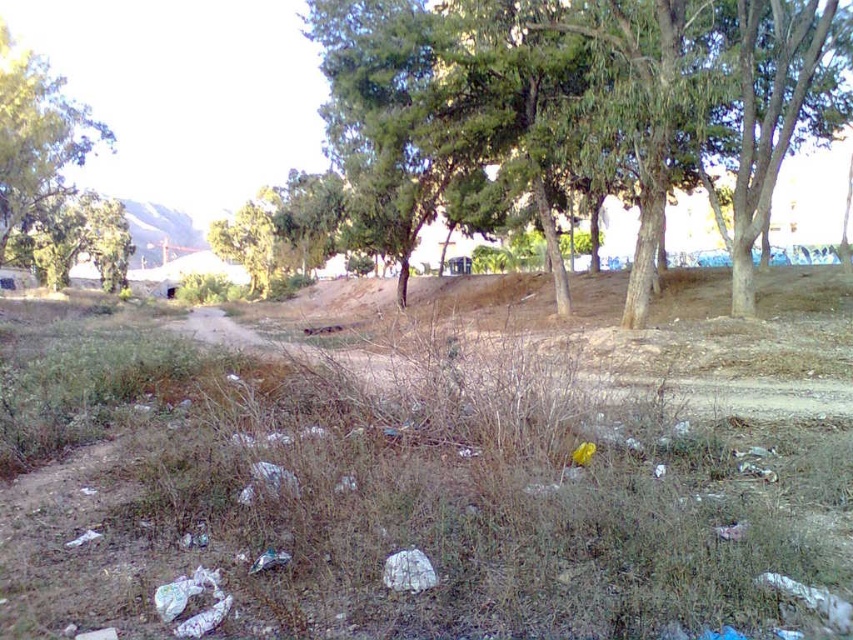
Based on the photo, which of these two, brown grassy dirt field at center or green leafy tree at center, stands taller?

green leafy tree at center

Does brown grassy dirt field at center have a larger size compared to green leafy tree at center?

No.

At what (x,y) coordinates should I click in order to perform the action: click on brown grassy dirt field at center. Please return your answer as a coordinate pair (x, y). Image resolution: width=853 pixels, height=640 pixels. Looking at the image, I should click on (428, 467).

Which is more to the left, brown grassy dirt field at center or green leafy tree at upper left?

green leafy tree at upper left

Is brown grassy dirt field at center to the right of green leafy tree at upper left from the viewer's perspective?

Yes, brown grassy dirt field at center is to the right of green leafy tree at upper left.

Does point (520, 627) come closer to viewer compared to point (19, 116)?

Yes.

This screenshot has width=853, height=640. I want to click on brown grassy dirt field at center, so click(428, 467).

Can you confirm if green leafy tree at center is positioned to the left of green leafy tree at upper left?

Incorrect, green leafy tree at center is not on the left side of green leafy tree at upper left.

Between green leafy tree at center and green leafy tree at upper left, which one appears on the left side from the viewer's perspective?

Positioned to the left is green leafy tree at upper left.

I want to click on green leafy tree at center, so click(718, 99).